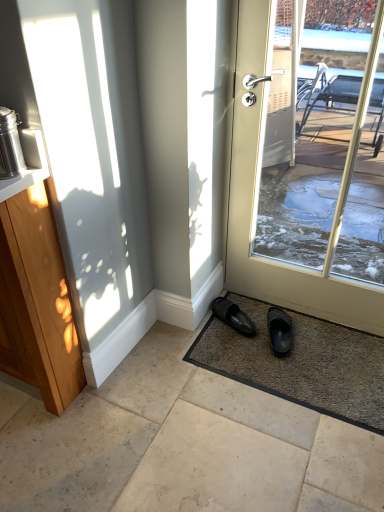
Locate an element on the screen. The height and width of the screenshot is (512, 384). unoccupied region to the right of wooden cabinet at left is located at coordinates (168, 382).